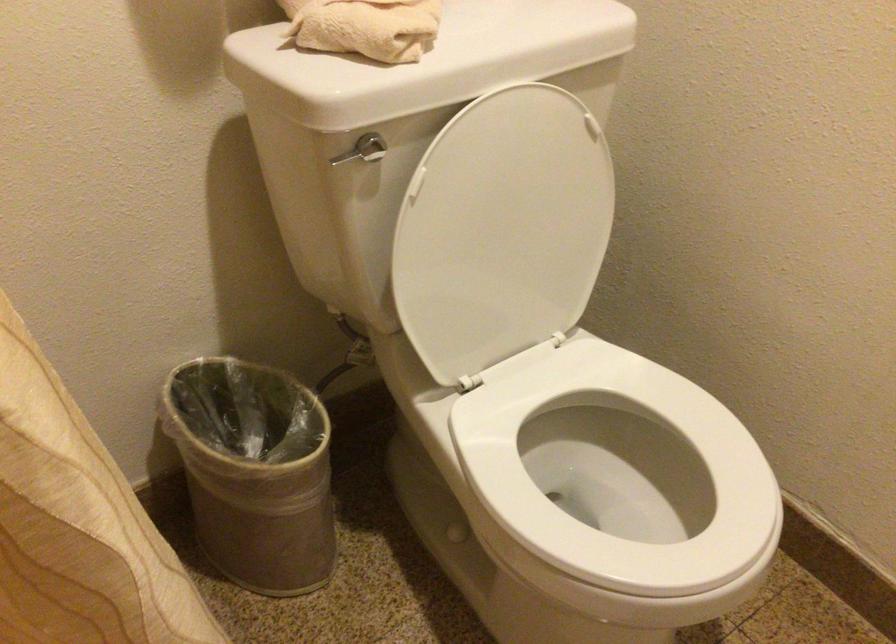
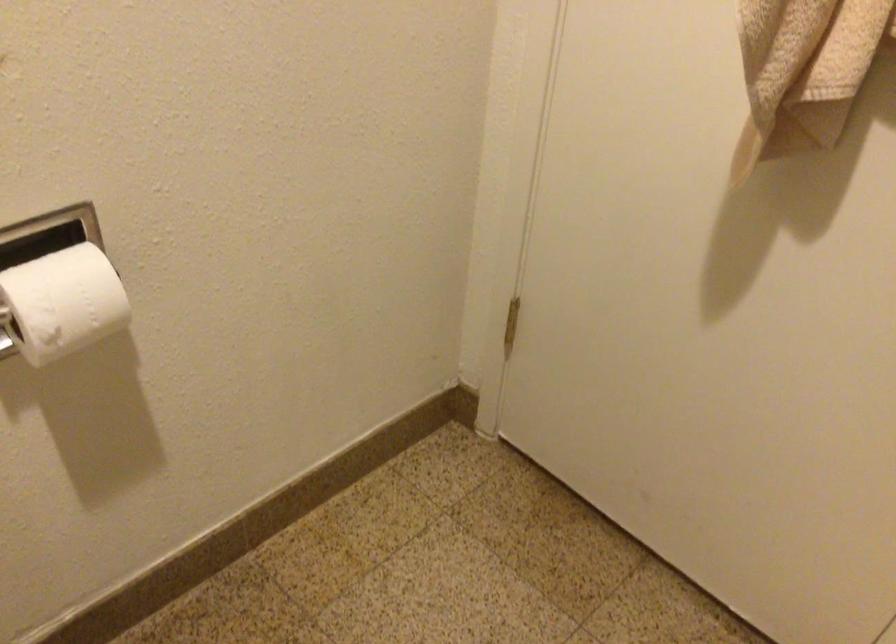
First-person continuous shooting, in which direction is the camera rotating?

The camera rotated toward right-down.